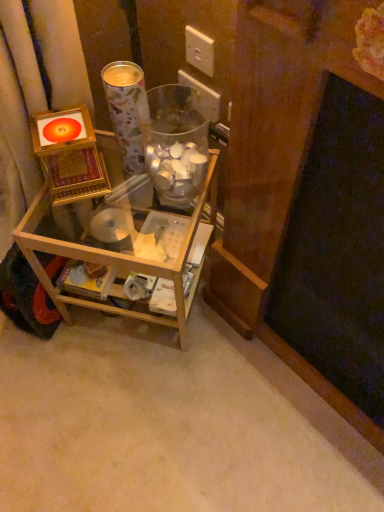
Question: Does metallic paper cup at upper center have a greater height compared to white plastic electric outlet at upper center, acting as the 1th electric outlet starting from the back?

Choices:
 (A) no
 (B) yes

Answer: (B)

Question: From the image's perspective, is metallic paper cup at upper center beneath white plastic electric outlet at upper center, acting as the 1th electric outlet starting from the back?

Choices:
 (A) no
 (B) yes

Answer: (B)

Question: Is white plastic electric outlet at upper center, the second electric outlet when ordered from front to back, at the back of metallic paper cup at upper center?

Choices:
 (A) yes
 (B) no

Answer: (B)

Question: Considering the relative sizes of metallic paper cup at upper center and white plastic electric outlet at upper center, acting as the 1th electric outlet starting from the back, in the image provided, is metallic paper cup at upper center wider than white plastic electric outlet at upper center, acting as the 1th electric outlet starting from the back,?

Choices:
 (A) no
 (B) yes

Answer: (B)

Question: Is white plastic electric outlet at upper center, acting as the 1th electric outlet starting from the back, completely or partially inside metallic paper cup at upper center?

Choices:
 (A) no
 (B) yes

Answer: (A)

Question: In terms of width, does white plastic electric outlet at upper center, marked as the first electric outlet in a front-to-back arrangement, look wider or thinner when compared to transparent glass jar at center?

Choices:
 (A) wide
 (B) thin

Answer: (B)

Question: From the image's perspective, relative to transparent glass jar at center, is white plastic electric outlet at upper center, marked as the first electric outlet in a front-to-back arrangement, above or below?

Choices:
 (A) above
 (B) below

Answer: (A)

Question: Choose the correct answer: Is white plastic electric outlet at upper center, which ranks as the second electric outlet in back-to-front order, inside transparent glass jar at center or outside it?

Choices:
 (A) inside
 (B) outside

Answer: (B)

Question: Visually, is white plastic electric outlet at upper center, which ranks as the second electric outlet in back-to-front order, positioned to the left or to the right of transparent glass jar at center?

Choices:
 (A) left
 (B) right

Answer: (B)

Question: Is white plastic electric outlet at upper center, acting as the 1th electric outlet starting from the back, inside or outside of clear wood shelf at center?

Choices:
 (A) outside
 (B) inside

Answer: (A)

Question: Would you say white plastic electric outlet at upper center, the second electric outlet when ordered from front to back, is to the left or to the right of clear wood shelf at center in the picture?

Choices:
 (A) left
 (B) right

Answer: (B)

Question: From the image's perspective, is white plastic electric outlet at upper center, acting as the 1th electric outlet starting from the back, positioned above or below clear wood shelf at center?

Choices:
 (A) below
 (B) above

Answer: (B)

Question: Considering the positions of white plastic electric outlet at upper center, the second electric outlet when ordered from front to back, and clear wood shelf at center in the image, is white plastic electric outlet at upper center, the second electric outlet when ordered from front to back, bigger or smaller than clear wood shelf at center?

Choices:
 (A) small
 (B) big

Answer: (A)

Question: Is point (208, 106) closer or farther from the camera than point (137, 89)?

Choices:
 (A) closer
 (B) farther

Answer: (B)

Question: Is white plastic electric outlet at upper center, the second electric outlet when ordered from front to back, situated inside metallic paper cup at upper center or outside?

Choices:
 (A) inside
 (B) outside

Answer: (B)